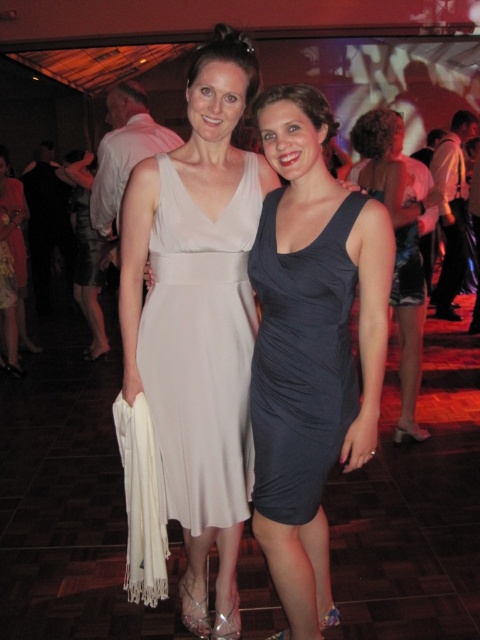
You are a photographer at a party and need to capture both the satin white dress at center and the dark blue satin dress at center in the same frame. The camera you are using has a minimum distance requirement of 5 feet between subjects to ensure both are in focus. Can you fit both dresses in the frame without moving either of them?

The satin white dress at center and dark blue satin dress at center are 4.86 feet apart from each other, which is less than the required 5 feet. Therefore, you cannot fit both dresses in the frame without moving them.

You are a photographer at a fashion show. You need to arrange two models wearing the matte white dress at center and dark blue satin dress at center side by side. Based on the description, which dress might require more space between the models?

The matte white dress at center might require more space between the models because it is wider than the dark blue satin dress at center.

You are at a party and see two women standing close together. The woman on the left is wearing a light beige dress, and the woman on the right is in a dark blue dress. There is also a matte white dress at center. Which dress is positioned exactly in the middle of the two women?

The matte white dress at center is located at point (199, 317), which is exactly between the two women.